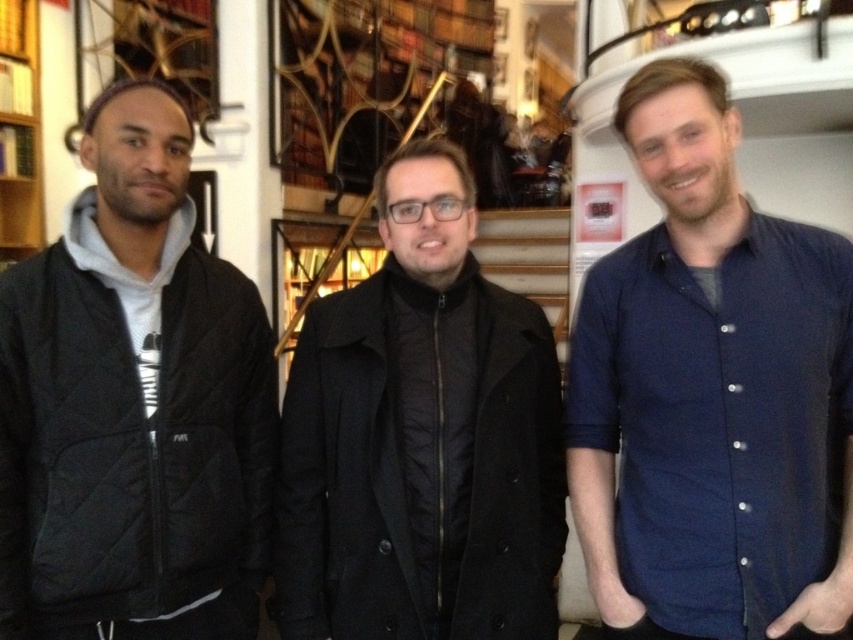
You are a photographer setting up a shoot in this scene. You need to place a small prop between the blue cotton shirt at right and the black quilted jacket at center. Where should you place it to ensure it is centered between them?

The prop should be placed to the left of the blue cotton shirt at right and to the right of the black quilted jacket at center, as the blue cotton shirt at right is positioned on the right side of the black quilted jacket at center.

You are a photographer setting up for a group photo in a bookstore. You need to arrange the blue cotton shirt at right and the black quilted jacket at center so that both fit within a 1.2 meter wide frame. Given their sizes, will they fit side by side?

The blue cotton shirt at right is narrower than the black quilted jacket at center. Since the total width of both would be more than 1.2 meters, they might not fit side by side within the frame.